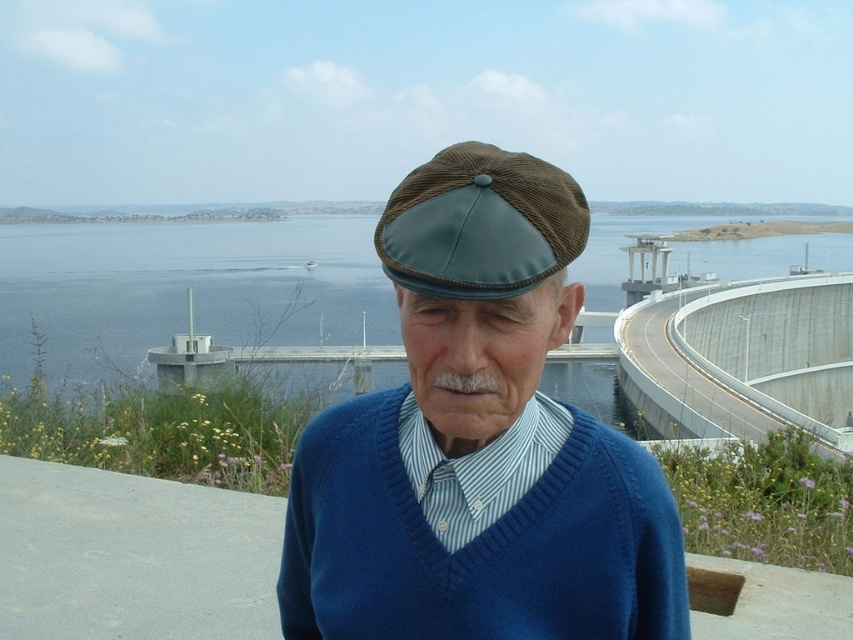
Question: Is blue water at center wider than concrete at right?

Choices:
 (A) yes
 (B) no

Answer: (A)

Question: Which point appears farthest from the camera in this image?

Choices:
 (A) (712, 388)
 (B) (434, 593)
 (C) (38, 268)
 (D) (236, 579)

Answer: (C)

Question: Is the position of matte brown leather cap at center more distant than that of brown corduroy cap at center?

Choices:
 (A) yes
 (B) no

Answer: (B)

Question: Which object appears closest to the camera in this image?

Choices:
 (A) brown corduroy cap at center
 (B) concrete at right

Answer: (A)

Question: Which of these objects is positioned closest to the blue knitted sweater at center?

Choices:
 (A) blue water at center
 (B) matte brown leather cap at center
 (C) brown corduroy cap at center

Answer: (B)

Question: Is blue water at center smaller than brown corduroy cap at center?

Choices:
 (A) yes
 (B) no

Answer: (B)